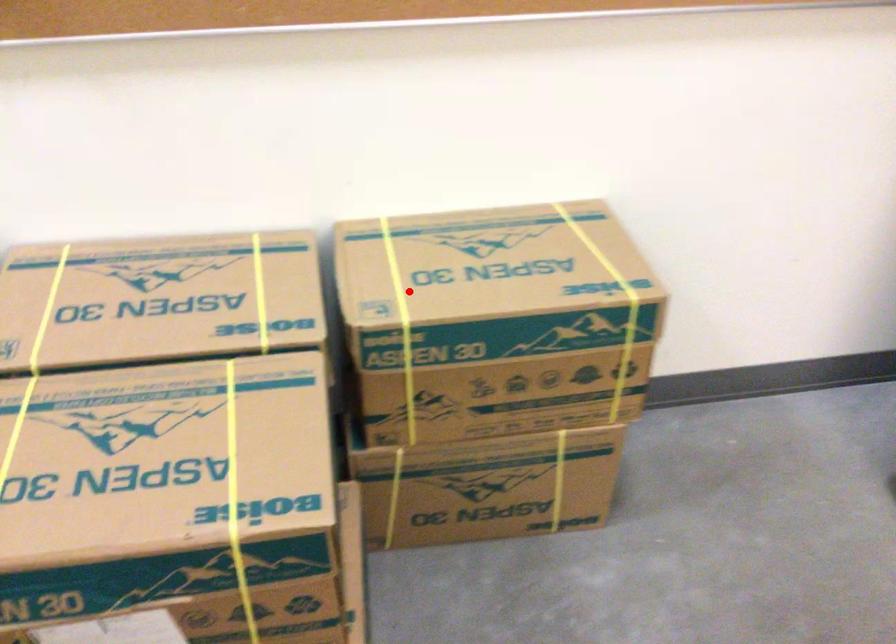
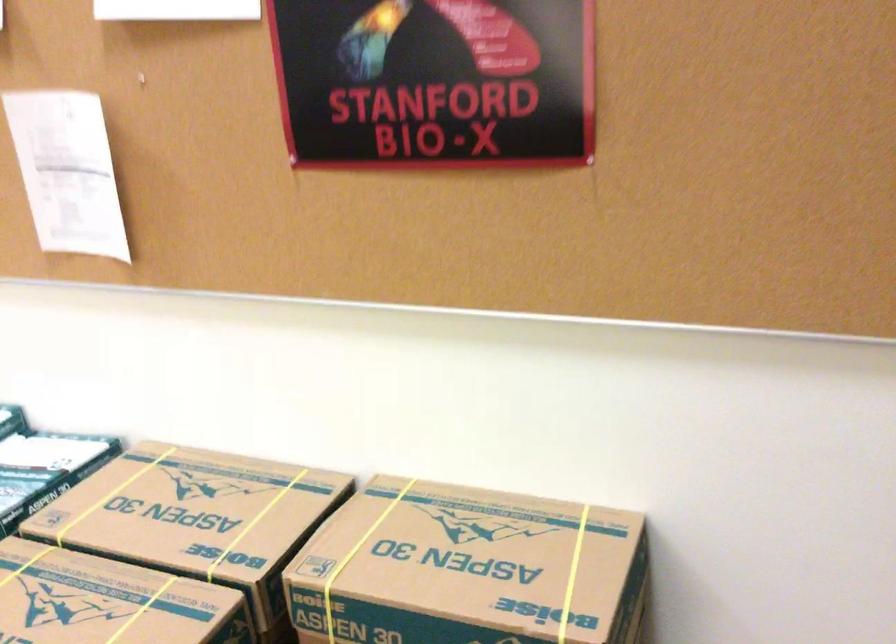
Where in the second image is the point corresponding to the highlighted location from the first image?

(357, 556)